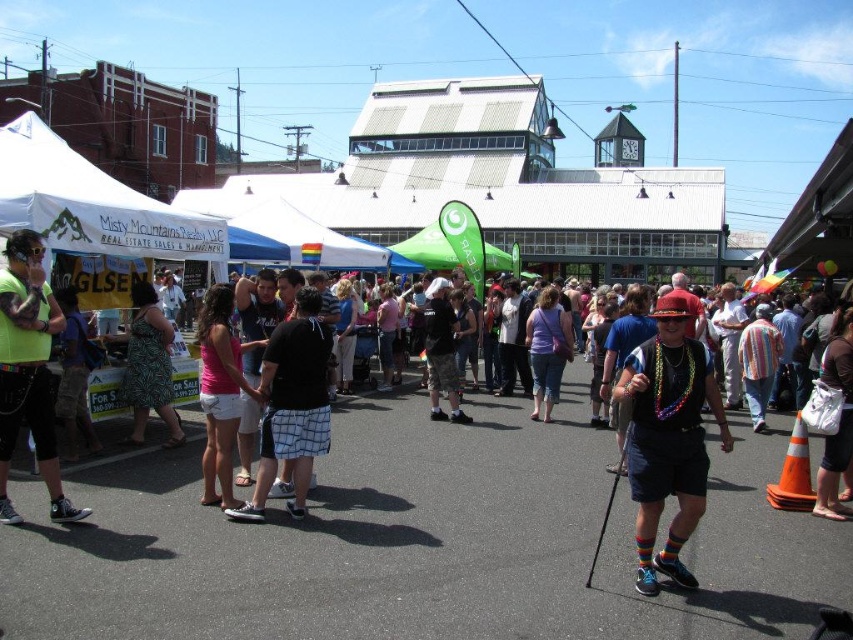
Which is above, pink fabric shorts at center or green printed dress at center?

green printed dress at center is higher up.

Who is lower down, pink fabric shorts at center or green printed dress at center?

pink fabric shorts at center

Does point (256, 394) come closer to viewer compared to point (138, 333)?

That is True.

The height and width of the screenshot is (640, 853). Identify the location of pink fabric shorts at center. (219, 392).

Is point (680, 579) farther from viewer compared to point (212, 390)?

No, (680, 579) is closer to viewer.

Is rainbow striped socks at center wider than pink fabric shorts at center?

No, rainbow striped socks at center is not wider than pink fabric shorts at center.

Does point (698, 445) come farther from viewer compared to point (219, 304)?

No, (698, 445) is closer to viewer.

Where is `rainbow striped socks at center`? The height and width of the screenshot is (640, 853). rainbow striped socks at center is located at coordinates (668, 438).

How distant is rainbow striped socks at center from green printed dress at center?

rainbow striped socks at center and green printed dress at center are 22.05 meters apart.

Consider the image. Which is more to the right, rainbow striped socks at center or green printed dress at center?

rainbow striped socks at center is more to the right.

I want to click on rainbow striped socks at center, so click(668, 438).